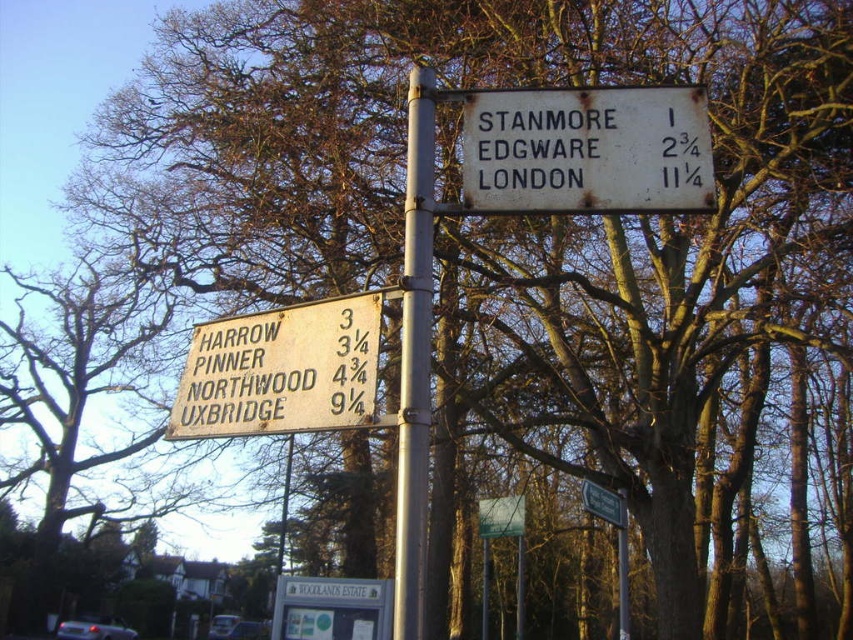
You are a delivery driver trying to secure a package to the silver metallic pole at center and the green plastic street sign at center. Which object will be easier to attach the package to based on their size?

The silver metallic pole at center occupies less space than the green plastic street sign at center, so the green plastic street sign at center will be easier to attach the package to because it has a larger surface area.

You are a pedestrian trying to walk from the brown wooden sign at lower left to the silver metallic pole at center. Can you walk directly between them without going around?

The silver metallic pole at center is behind the brown wooden sign at lower left, so you cannot walk directly between them without going around.

You are standing in front of a street signpost with two horizontal signs. The top sign has distances to STANMORE, EDGWARE, and LONDON, while the bottom sign lists distances to HARROW, PINNER, NORTHWOOD, and UXBRIDGE. There is a point marked at coordinates point (288,611). If you want to touch this point with a 4.5 meter long stick, will you be able to reach it?

The point (288,611) is 4.64 meters away from the camera. Since the stick is only 4.5 meters long, you cannot reach the point with the stick.